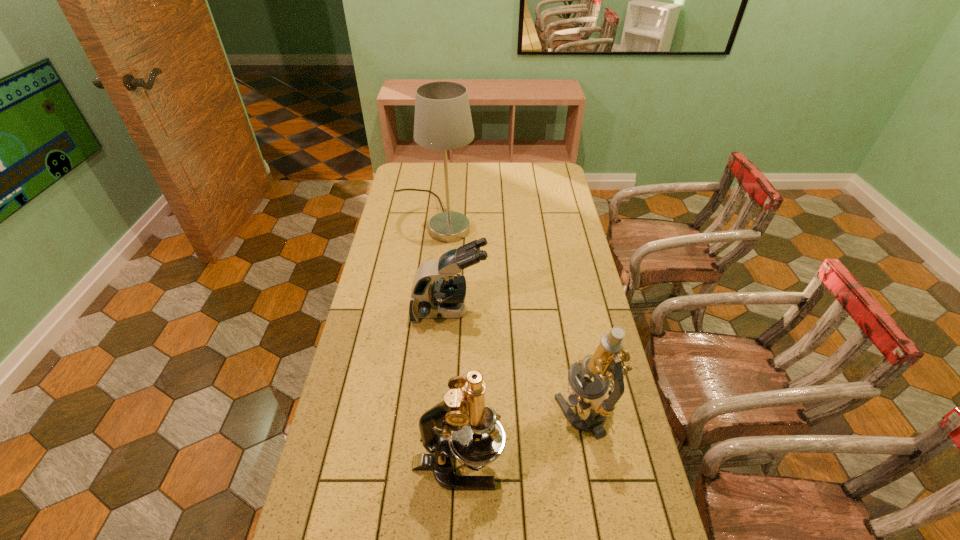
I want to click on blank space at the far edge of the desktop, so click(524, 179).

In the image, there is a desktop. Identify the location of vacant space at the left edge. (340, 534).

I want to click on blank space at the right edge of the desktop, so click(577, 440).

In the image, there is a desktop. Where is `vacant space at the far left corner`? vacant space at the far left corner is located at coordinates (401, 171).

Locate an element on the screen. Image resolution: width=960 pixels, height=540 pixels. free space that is in between the rightmost microscope and the third nearest object is located at coordinates (x=516, y=362).

Find the location of `vacant area that lies between the second farthest object and the rightmost microscope`. vacant area that lies between the second farthest object and the rightmost microscope is located at coordinates (516, 362).

Where is `free point between the farthest object and the rightmost microscope`? The image size is (960, 540). free point between the farthest object and the rightmost microscope is located at coordinates (508, 314).

Where is `empty space between the farthest microscope and the rightmost microscope`? empty space between the farthest microscope and the rightmost microscope is located at coordinates (516, 362).

The height and width of the screenshot is (540, 960). In order to click on empty space that is in between the farthest microscope and the rightmost object in this screenshot , I will do coord(516,362).

The width and height of the screenshot is (960, 540). I want to click on object that ranks as the second closest to the rightmost object, so click(x=436, y=293).